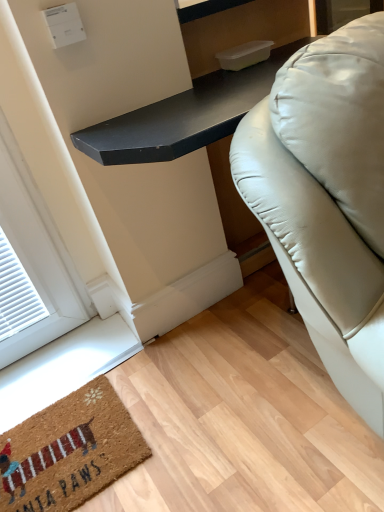
Locate an element on the screen. Image resolution: width=384 pixels, height=512 pixels. unoccupied region to the right of brown coir mat at lower left is located at coordinates (185, 417).